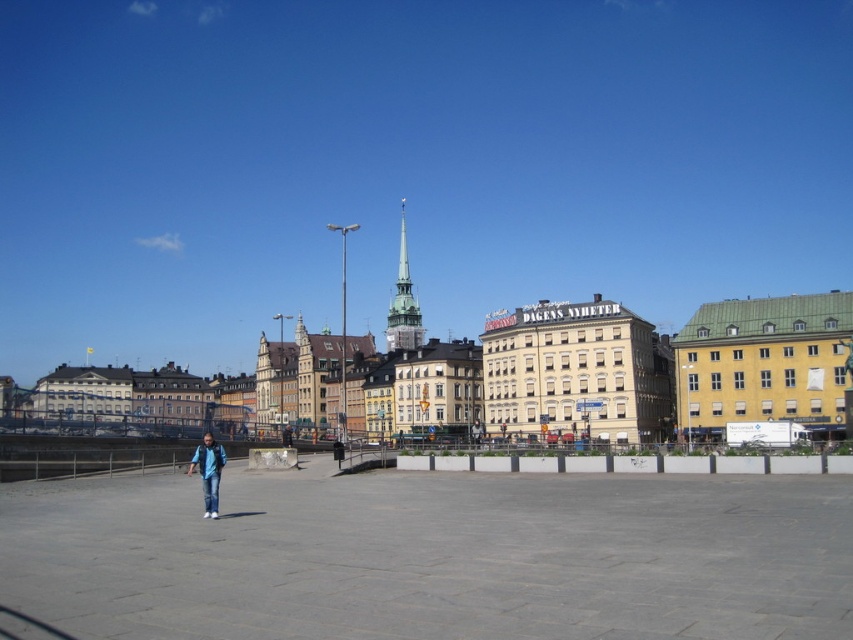
Question: Which object appears farthest from the camera in this image?

Choices:
 (A) blue denim jeans at center
 (B) blue jeans at center
 (C) blue denim jeans at lower left

Answer: (A)

Question: Is gold textured spire at center above blue denim jeans at lower left?

Choices:
 (A) yes
 (B) no

Answer: (A)

Question: Is the position of gold textured spire at center less distant than that of blue jeans at center?

Choices:
 (A) yes
 (B) no

Answer: (B)

Question: Which of these objects is positioned farthest from the blue denim jeans at lower left?

Choices:
 (A) gold textured spire at center
 (B) blue jeans at center
 (C) blue denim jeans at center

Answer: (A)

Question: Estimate the real-world distances between objects in this image. Which object is closer to the blue jeans at center?

Choices:
 (A) blue denim jeans at center
 (B) gold textured spire at center
 (C) blue denim jeans at lower left

Answer: (A)

Question: Does gold textured spire at center lie in front of blue denim jeans at center?

Choices:
 (A) no
 (B) yes

Answer: (A)